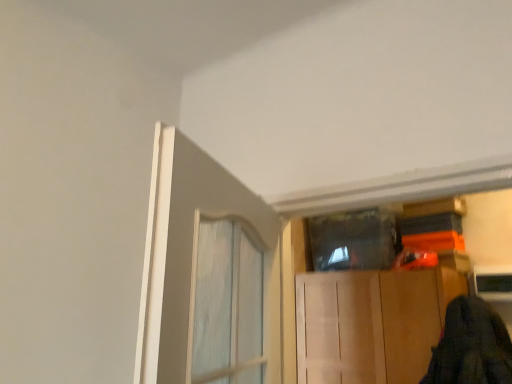
In order to click on white wood cabinet at center in this screenshot , I will do `click(371, 323)`.

Describe the element at coordinates (371, 323) in the screenshot. I see `white wood cabinet at center` at that location.

In order to click on white wood cabinet at center in this screenshot , I will do `click(371, 323)`.